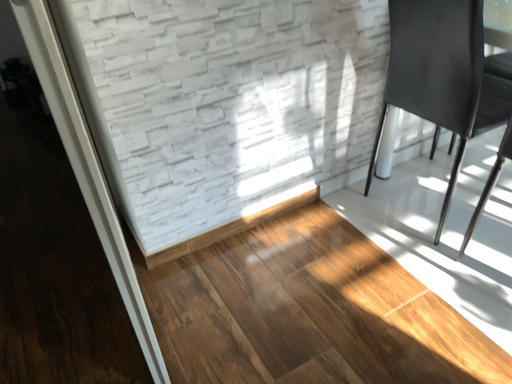
The height and width of the screenshot is (384, 512). Find the location of `free space underneath matte black chair at right (from a real-world perspective)`. free space underneath matte black chair at right (from a real-world perspective) is located at coordinates (430, 211).